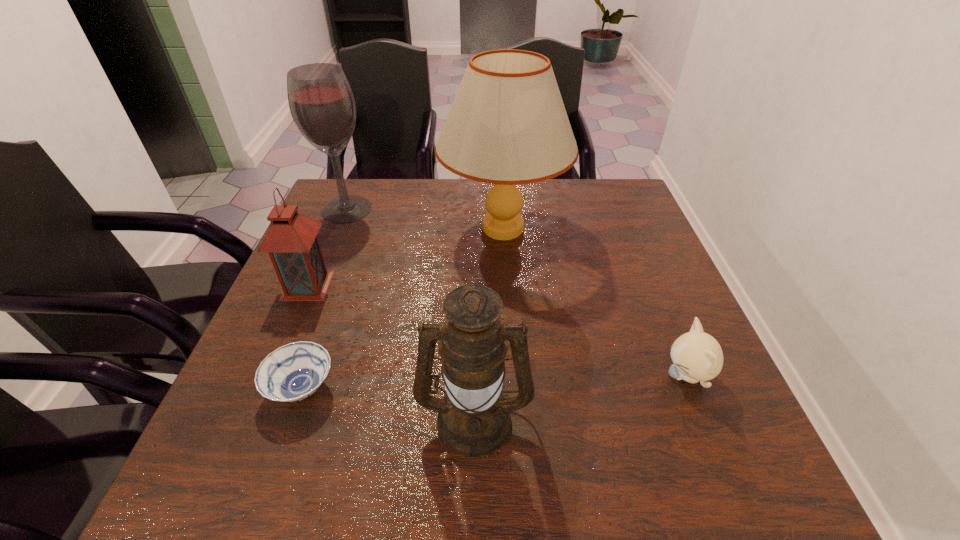
You are a GUI agent. You are given a task and a screenshot of the screen. Output one action in this format:
    pyautogui.click(x=<x>, y=<y>)
    Task: Click on the free spot located 0.200m on the right of the oil lamp
    
    Given the screenshot: What is the action you would take?
    pyautogui.click(x=641, y=417)

The image size is (960, 540). I want to click on vacant space located 0.270m on the back of the fourth nearest object, so click(340, 210).

This screenshot has width=960, height=540. What are the coordinates of `blank space located 0.400m on the face of the second shortest object` in the screenshot? It's located at (459, 376).

Locate an element on the screen. vacant space positioned 0.220m on the face of the second shortest object is located at coordinates (551, 376).

This screenshot has width=960, height=540. I want to click on free space located 0.200m on the face of the second shortest object, so click(x=562, y=376).

Identify the location of vacant space located 0.050m on the left of the soup bowl. (241, 388).

Identify the location of lampshade that is positioned at the far edge. (507, 125).

Identify the location of alcohol located in the far edge section of the desktop. (321, 102).

Find the location of a particular element. object situated at the near edge is located at coordinates (474, 420).

What are the coordinates of `alcohol that is at the left edge` in the screenshot? It's located at (321, 102).